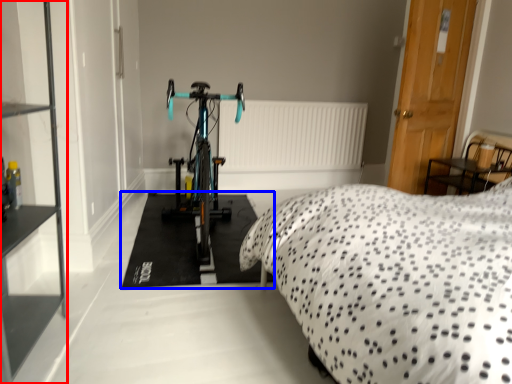
Question: Among these objects, which one is nearest to the camera, shelf (highlighted by a red box) or flat (highlighted by a blue box)?

Choices:
 (A) shelf
 (B) flat

Answer: (A)